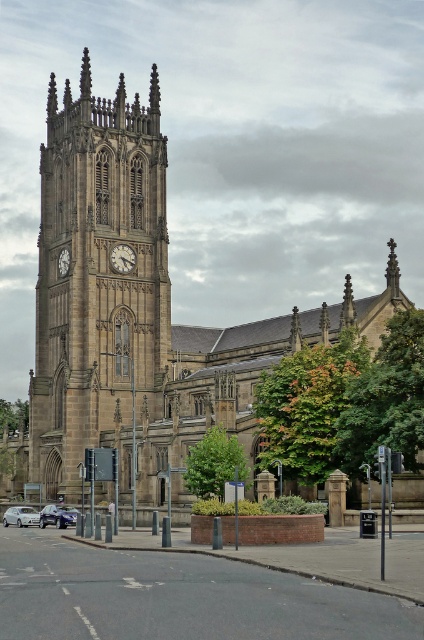
Question: Is brown stone church at center further to camera compared to stone clock tower at left?

Choices:
 (A) no
 (B) yes

Answer: (A)

Question: Among these points, which one is nearest to the camera?

Choices:
 (A) (61, 268)
 (B) (55, 518)

Answer: (B)

Question: Which of the following is the closest to the observer?

Choices:
 (A) (133, 362)
 (B) (113, 444)

Answer: (B)

Question: Can you confirm if stone clock tower at left is wider than white marble clock at center?

Choices:
 (A) no
 (B) yes

Answer: (B)

Question: Which object appears farthest from the camera in this image?

Choices:
 (A) brown stone church at center
 (B) white glossy clock at left
 (C) metallic silver car at lower left

Answer: (B)

Question: Does brown stone church at center have a greater width compared to stone clock tower at left?

Choices:
 (A) no
 (B) yes

Answer: (B)